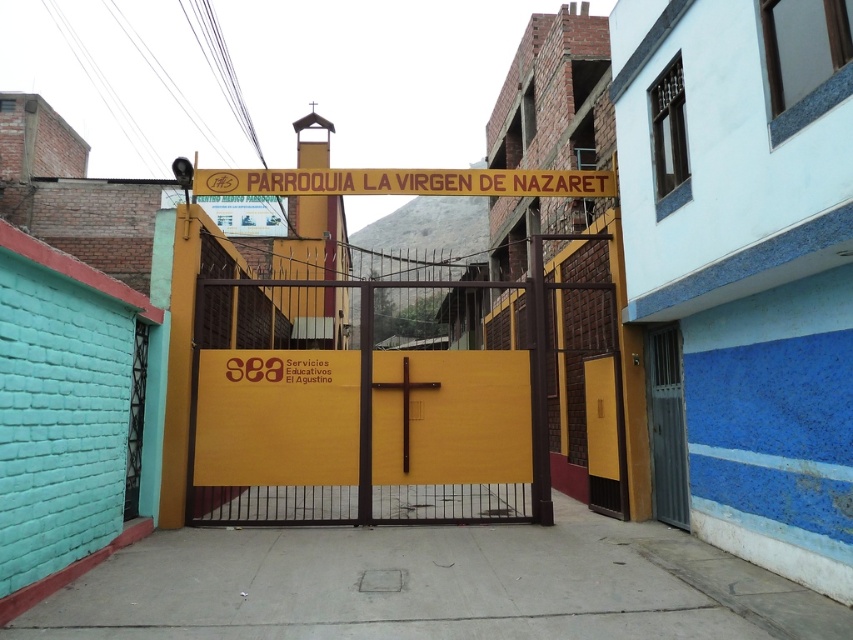
Who is more forward, (x=289, y=476) or (x=480, y=170)?

Positioned in front is point (x=289, y=476).

Image resolution: width=853 pixels, height=640 pixels. I want to click on yellow matte sign at center, so click(277, 417).

Locate an element on the screen. The width and height of the screenshot is (853, 640). yellow matte sign at center is located at coordinates (277, 417).

Does yellow matte sign at center appear on the right side of matte yellow door at right?

No, yellow matte sign at center is not to the right of matte yellow door at right.

Is yellow matte sign at center below matte yellow door at right?

No.

In order to click on yellow matte sign at center in this screenshot , I will do `click(277, 417)`.

Which is in front, point (276, 193) or point (677, 404)?

Point (677, 404)

Which is behind, point (241, 189) or point (660, 326)?

Positioned behind is point (241, 189).

Who is more distant from viewer, (256,186) or (666,385)?

The point (256,186) is behind.

Locate an element on the screen. Image resolution: width=853 pixels, height=640 pixels. yellow matte signboard at upper center is located at coordinates (404, 180).